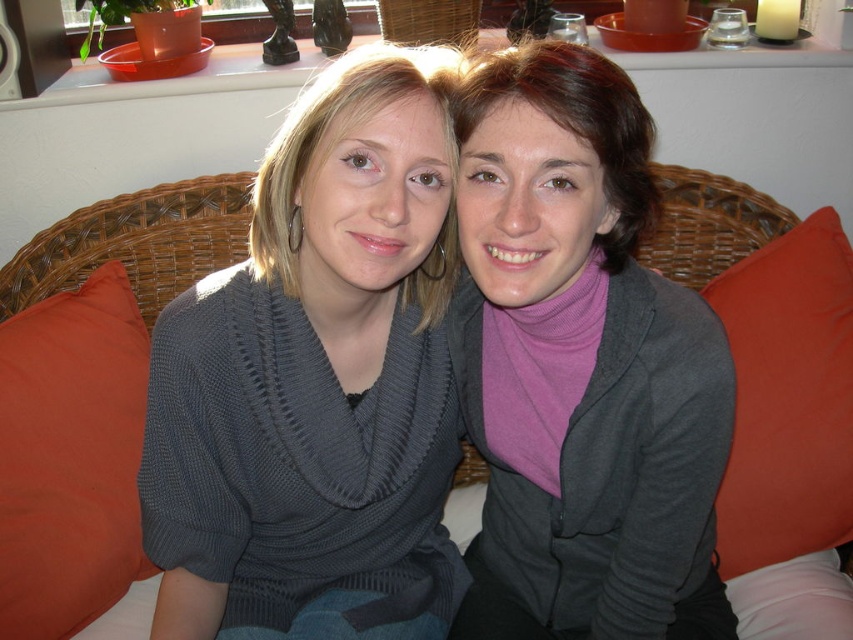
Which is in front, point (192, 554) or point (741, 188)?

Point (192, 554)

The image size is (853, 640). What do you see at coordinates (316, 380) in the screenshot?
I see `gray knit sweater at center` at bounding box center [316, 380].

Who is more forward, (x=378, y=554) or (x=244, y=220)?

Point (x=378, y=554)

Identify the location of gray knit sweater at center. This screenshot has width=853, height=640. (316, 380).

How distant is orange fabric pillow at left from orange fabric pillow at right?

orange fabric pillow at left and orange fabric pillow at right are 36.21 inches apart from each other.

How much distance is there between orange fabric pillow at left and orange fabric pillow at right?

orange fabric pillow at left and orange fabric pillow at right are 36.21 inches apart.

Is point (83, 593) in front of point (840, 272)?

That is True.

The image size is (853, 640). In order to click on orange fabric pillow at left in this screenshot , I will do `click(70, 456)`.

Does purple matte turtleneck at center have a lesser height compared to woven wicker couch at center?

No.

Is point (544, 164) closer to viewer compared to point (190, 253)?

Yes, point (544, 164) is closer to viewer.

Is point (656, 556) farther from camera compared to point (810, 513)?

No, (656, 556) is in front of (810, 513).

Image resolution: width=853 pixels, height=640 pixels. I want to click on purple matte turtleneck at center, so click(x=584, y=365).